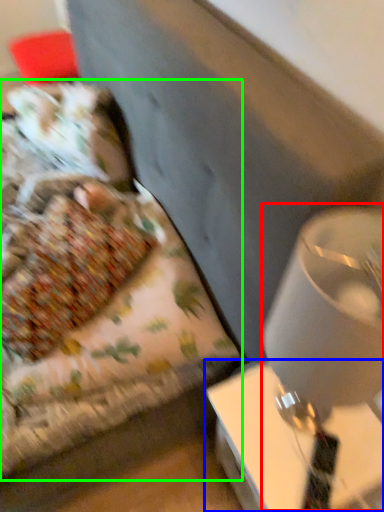
Question: Considering the real-world distances, which object is closest to table lamp (highlighted by a red box)? table (highlighted by a blue box) or bed (highlighted by a green box).

Choices:
 (A) table
 (B) bed

Answer: (A)